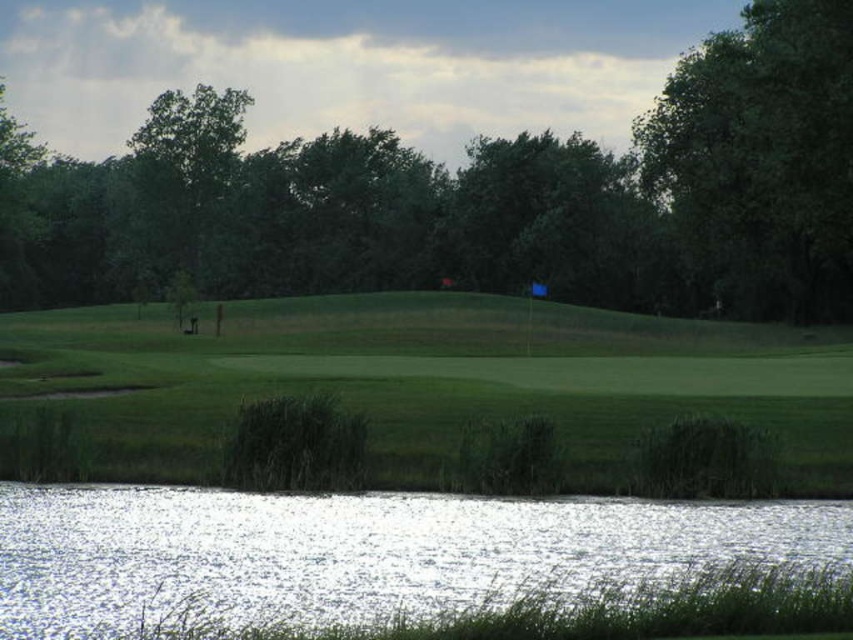
You are a golfer standing on the fairway and see the clear water at lower left and the green leafy tree at upper right. Which object is closer to you?

The clear water at lower left is closer to you because it is positioned under the green leafy tree at upper right, meaning it is in a lower, nearer position in the scene.

What is the exact coordinate of the clear water at lower left in the image?

The clear water at lower left is located at point (x=355, y=550).

You are standing at the point marked by the coordinate point at (x=355, y=550) in this golf course scene. What can you see in the direction of the lower left from your current position?

In the direction of the lower left from the coordinate point at (x=355, y=550), you can see clear water.